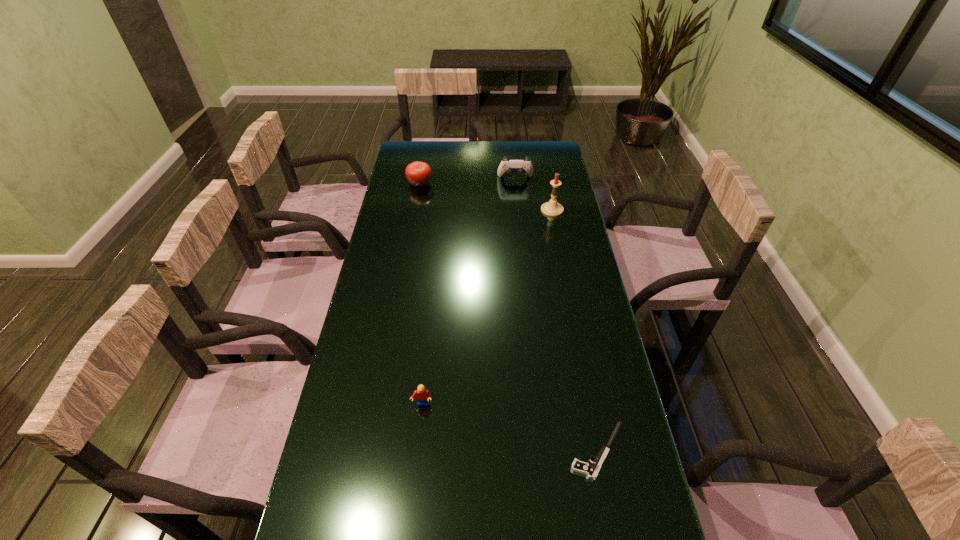
Locate an element on the screen. vacant point located between the pistol and the candle is located at coordinates (575, 330).

Identify the location of unoccupied position between the candle and the control. (534, 194).

This screenshot has height=540, width=960. Identify the location of empty location between the candle and the Lego. (487, 307).

Where is `vacant area that lies between the shortest object and the control`? vacant area that lies between the shortest object and the control is located at coordinates (557, 315).

At what (x,y) coordinates should I click in order to perform the action: click on object that is the second closest one to the candle. Please return your answer as a coordinate pair (x, y). The height and width of the screenshot is (540, 960). Looking at the image, I should click on (418, 173).

The image size is (960, 540). I want to click on the fourth closest object to the pistol, so click(418, 173).

Locate an element on the screen. vacant space that satisfies the following two spatial constraints: 1. on the front side of the tallest object; 2. on the front-facing side of the shortest object is located at coordinates (599, 451).

You are a GUI agent. You are given a task and a screenshot of the screen. Output one action in this format:
    pyautogui.click(x=<x>, y=<y>)
    Task: Click on the free spot that satisfies the following two spatial constraints: 1. on the front-facing side of the tallest object; 2. on the left side of the control
    
    Given the screenshot: What is the action you would take?
    pyautogui.click(x=518, y=210)